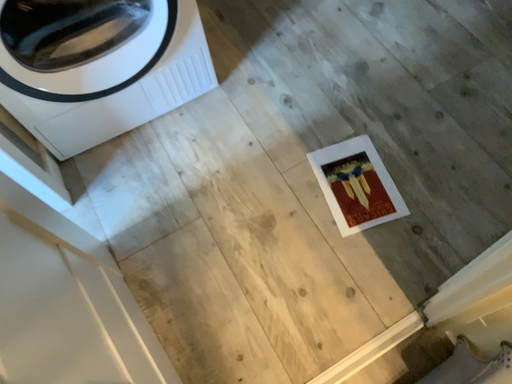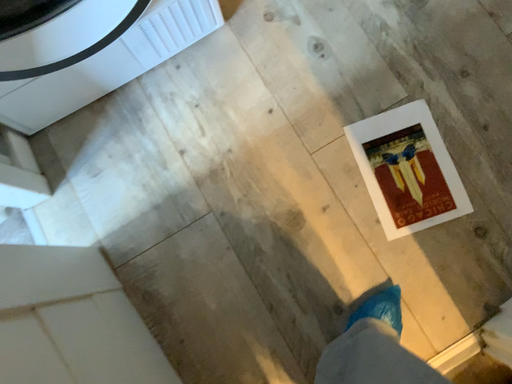
Question: How did the camera likely rotate when shooting the video?

Choices:
 (A) rotated downward
 (B) rotated upward

Answer: (A)